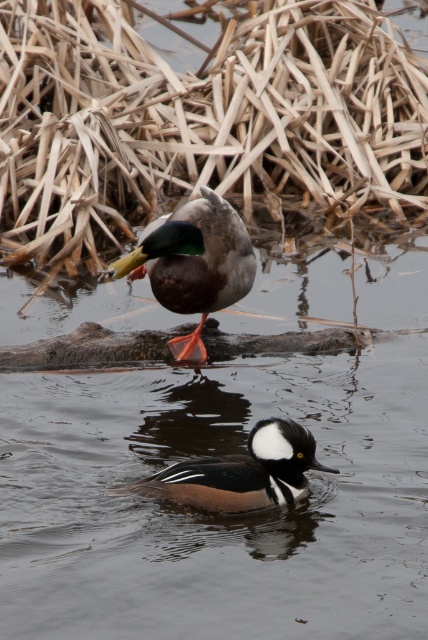
Can you confirm if brown dry reed at upper center is shorter than shiny brown duck at center?

Incorrect, brown dry reed at upper center's height does not fall short of shiny brown duck at center's.

This screenshot has width=428, height=640. Find the location of `brown dry reed at upper center`. brown dry reed at upper center is located at coordinates click(199, 118).

Does brown dry reed at upper center lie behind brown speckled duck at center?

That is True.

Can you confirm if brown dry reed at upper center is positioned above brown speckled duck at center?

Indeed, brown dry reed at upper center is positioned over brown speckled duck at center.

Does point (228, 100) come behind point (261, 449)?

Yes, point (228, 100) is behind point (261, 449).

Identify the location of brown dry reed at upper center. This screenshot has height=640, width=428. (199, 118).

Between shiny brown duck at center and brown speckled duck at center, which one has more height?

shiny brown duck at center

Measure the distance from shiny brown duck at center to brown speckled duck at center.

shiny brown duck at center and brown speckled duck at center are 4.26 feet apart.

Between point (168, 266) and point (238, 508), which one is positioned in front?

Point (238, 508) is in front.

At what (x,y) coordinates should I click in order to perform the action: click on shiny brown duck at center. Please return your answer as a coordinate pair (x, y). Looking at the image, I should click on (193, 262).